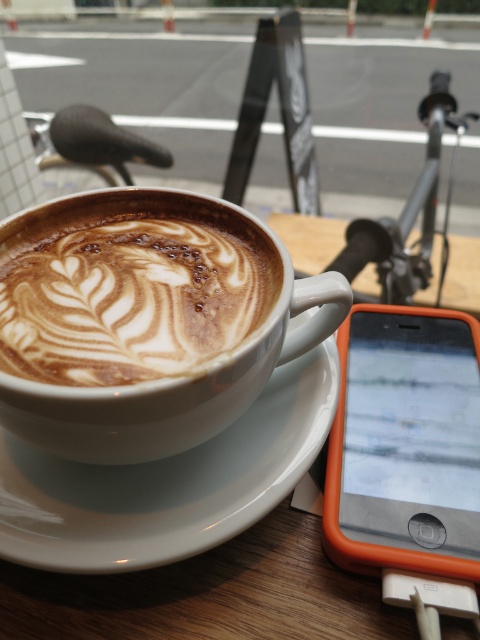
Consider the image. Who is taller, white ceramic saucer at center or orange plastic smartphone at lower right?

With more height is orange plastic smartphone at lower right.

Describe the element at coordinates (168, 483) in the screenshot. I see `white ceramic saucer at center` at that location.

Describe the element at coordinates (168, 483) in the screenshot. This screenshot has width=480, height=640. I see `white ceramic saucer at center` at that location.

Locate an element on the screen. The height and width of the screenshot is (640, 480). white ceramic saucer at center is located at coordinates (168, 483).

Is cappuccino foam at center to the left of white ceramic saucer at center from the viewer's perspective?

Yes, cappuccino foam at center is to the left of white ceramic saucer at center.

Find the location of a particular element. cappuccino foam at center is located at coordinates (131, 289).

What do you see at coordinates (131, 289) in the screenshot? Image resolution: width=480 pixels, height=640 pixels. I see `cappuccino foam at center` at bounding box center [131, 289].

Where is `cappuccino foam at center`? The width and height of the screenshot is (480, 640). cappuccino foam at center is located at coordinates (131, 289).

Can you confirm if cappuccino foam at center is positioned to the left of orange plastic smartphone at lower right?

Correct, you'll find cappuccino foam at center to the left of orange plastic smartphone at lower right.

Between cappuccino foam at center and orange plastic smartphone at lower right, which one is positioned lower?

orange plastic smartphone at lower right

Is point (56, 227) farther from viewer compared to point (389, 500)?

Yes, point (56, 227) is farther from viewer.

The image size is (480, 640). What are the coordinates of `cappuccino foam at center` in the screenshot? It's located at (131, 289).